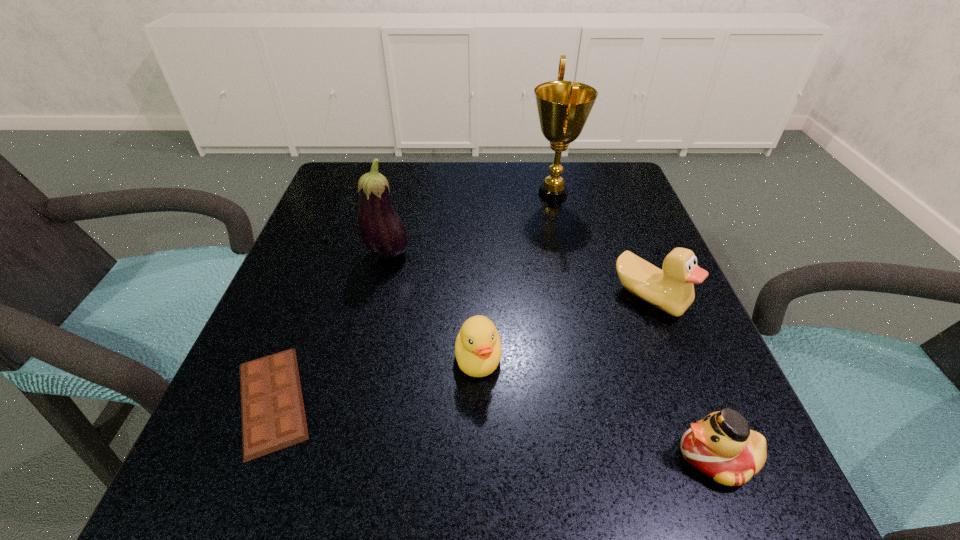
In order to click on vacant space situated 0.370m on the right of the shortest object in this screenshot , I will do `click(578, 400)`.

This screenshot has width=960, height=540. I want to click on object positioned at the far edge, so (x=563, y=107).

Where is `duck present at the near edge`? The height and width of the screenshot is (540, 960). duck present at the near edge is located at coordinates (722, 446).

The width and height of the screenshot is (960, 540). In order to click on chocolate bar at the near edge in this screenshot , I will do `click(273, 417)`.

Where is `eggplant that is at the left edge`? Image resolution: width=960 pixels, height=540 pixels. eggplant that is at the left edge is located at coordinates (383, 232).

I want to click on chocolate bar located in the left edge section of the desktop, so click(273, 417).

The width and height of the screenshot is (960, 540). I want to click on award at the right edge, so click(x=563, y=107).

Find the location of `object located at the near left corner`. object located at the near left corner is located at coordinates click(273, 417).

Where is `object present at the far right corner`? The image size is (960, 540). object present at the far right corner is located at coordinates (563, 107).

Image resolution: width=960 pixels, height=540 pixels. In order to click on object positioned at the near right corner in this screenshot , I will do `click(722, 446)`.